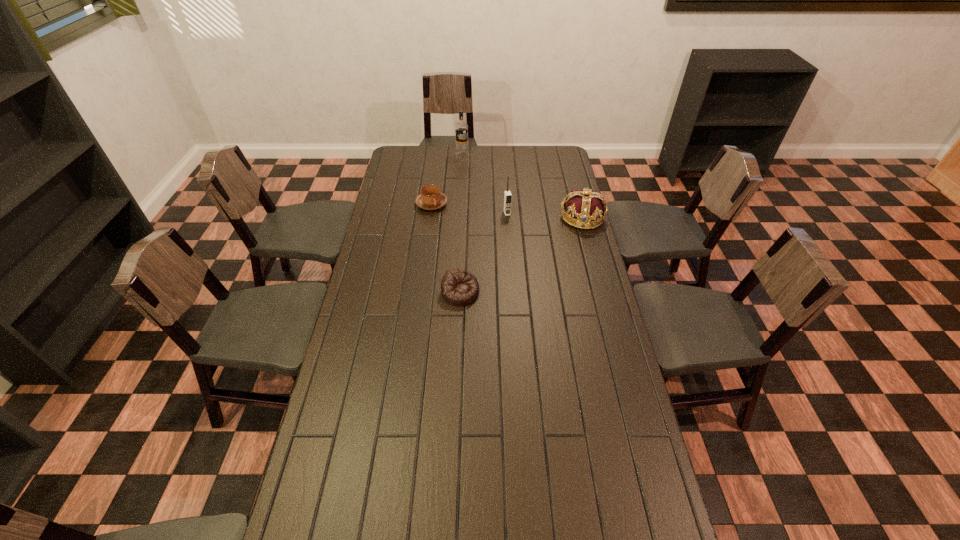
You are a GUI agent. You are given a task and a screenshot of the screen. Output one action in this format:
    pyautogui.click(x=<x>, y=<y>)
    Task: Click on the beanbag
    
    Given the screenshot: What is the action you would take?
    pyautogui.click(x=458, y=287)

Where is `the rightmost object`? The height and width of the screenshot is (540, 960). the rightmost object is located at coordinates (586, 207).

The width and height of the screenshot is (960, 540). Identify the location of the third shortest object. (586, 207).

Locate an element on the screen. cellular telephone is located at coordinates (507, 194).

This screenshot has width=960, height=540. What are the coordinates of `the fourth shortest object` in the screenshot? It's located at (507, 194).

The width and height of the screenshot is (960, 540). Find the location of `cappuccino`. cappuccino is located at coordinates (431, 198).

I want to click on vodka, so click(x=461, y=128).

Where is `the tallest object`? the tallest object is located at coordinates (461, 128).

This screenshot has height=540, width=960. In order to click on vacant area located 0.260m on the back of the beanbag in this screenshot , I will do `click(463, 235)`.

You are a GUI agent. You are given a task and a screenshot of the screen. Output one action in this format:
    pyautogui.click(x=<x>, y=<y>)
    Task: Click on the free point located on the front of the crown
    
    Given the screenshot: What is the action you would take?
    pyautogui.click(x=588, y=240)